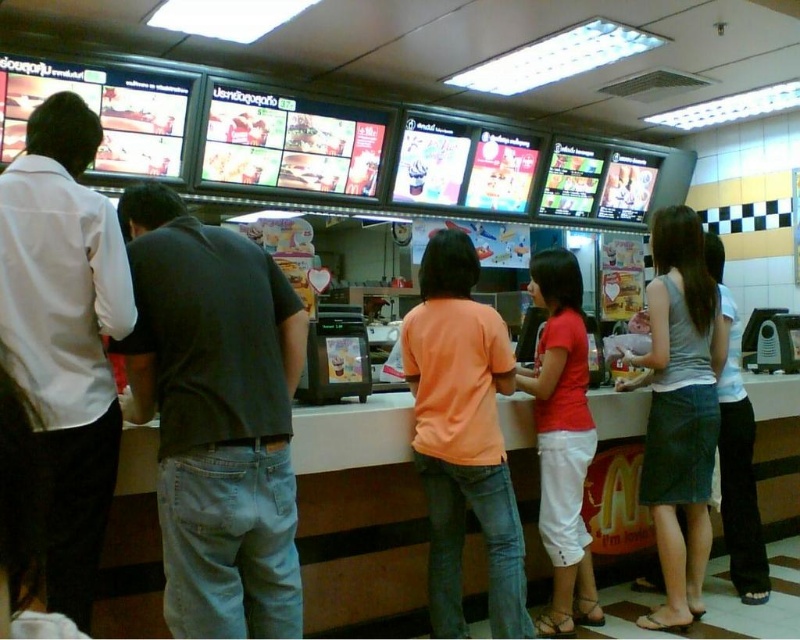
From the picture: Which of these two, white shirt at left or orange matte shirt at center, stands shorter?

Standing shorter between the two is white shirt at left.

Does white shirt at left appear under orange matte shirt at center?

Actually, white shirt at left is above orange matte shirt at center.

This screenshot has height=640, width=800. What do you see at coordinates (66, 332) in the screenshot?
I see `white shirt at left` at bounding box center [66, 332].

Locate an element on the screen. white shirt at left is located at coordinates (66, 332).

Does point (252, 353) come closer to viewer compared to point (696, 371)?

That is True.

Who is more distant from viewer, (128,216) or (688,257)?

Point (688,257)

This screenshot has width=800, height=640. Identify the location of dark gray jeans at center. (216, 417).

Can you confirm if orange matte shirt at center is bigger than red cotton shirt at center?

No, orange matte shirt at center is not bigger than red cotton shirt at center.

Looking at this image, how distant is orange matte shirt at center from red cotton shirt at center?

orange matte shirt at center is 14.37 inches away from red cotton shirt at center.

Image resolution: width=800 pixels, height=640 pixels. I want to click on orange matte shirt at center, so click(x=462, y=436).

Locate an element on the screen. Image resolution: width=800 pixels, height=640 pixels. orange matte shirt at center is located at coordinates point(462,436).